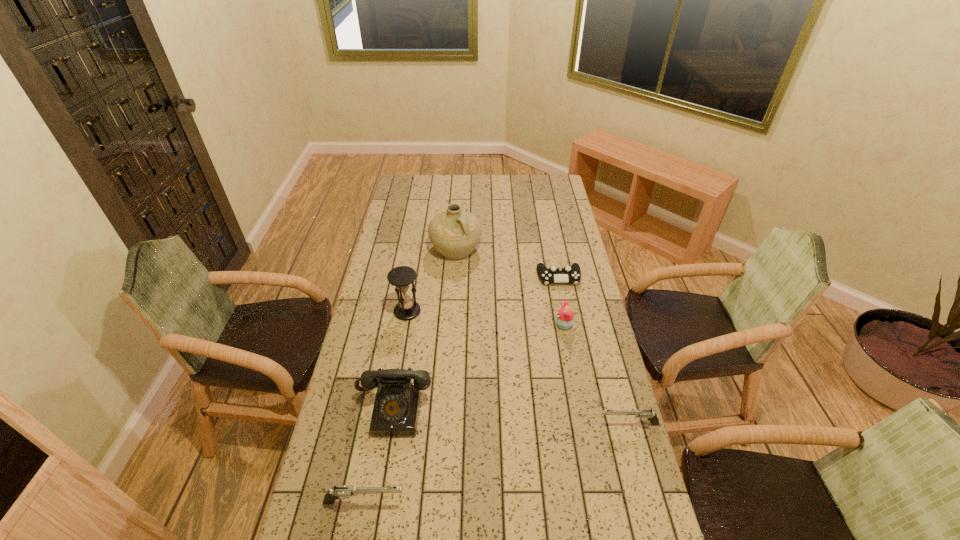
Locate an element on the screen. The image size is (960, 540). free space at the right edge of the desktop is located at coordinates (570, 262).

Find the location of a particular element. The height and width of the screenshot is (540, 960). vacant region at the far left corner of the desktop is located at coordinates (406, 175).

The image size is (960, 540). In order to click on vacant region at the far right corner of the desktop in this screenshot , I will do `click(547, 185)`.

Image resolution: width=960 pixels, height=540 pixels. What are the coordinates of `free space between the cupcake and the hourglass` in the screenshot? It's located at (486, 318).

At what (x,y) coordinates should I click in order to perform the action: click on free point between the second farthest object and the pottery. Please return your answer as a coordinate pair (x, y). Looking at the image, I should click on pos(508,264).

Locate an element on the screen. free space between the hourglass and the tallest object is located at coordinates (432, 280).

The width and height of the screenshot is (960, 540). In order to click on free space between the fifth shortest object and the farther pistol in this screenshot , I will do `click(512, 416)`.

At what (x,y) coordinates should I click in order to perform the action: click on free spot between the cupcake and the pottery. Please return your answer as a coordinate pair (x, y). Looking at the image, I should click on (510, 287).

Locate an element on the screen. This screenshot has width=960, height=540. vacant point located between the telephone and the shorter pistol is located at coordinates (512, 416).

At what (x,y) coordinates should I click in order to perform the action: click on free space between the right pistol and the tallest object. Please return your answer as a coordinate pair (x, y). Looking at the image, I should click on coord(542,337).